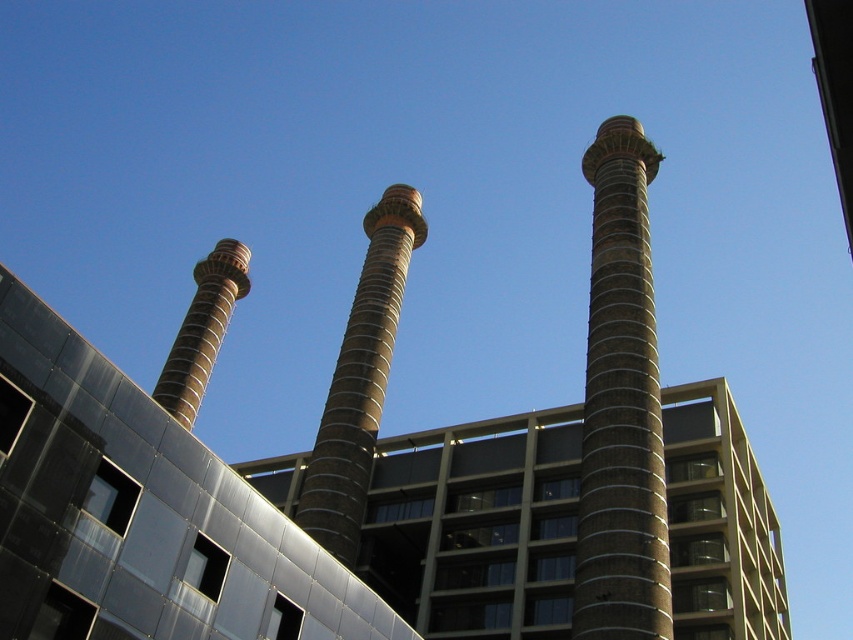
You are an architect reviewing the blueprint of the scene. You notice two structures, the brown textured tower at center and the brown textured chimney at left. Based on their positions in the image, which one appears closer to the ground?

The brown textured tower at center appears closer to the ground since it is positioned below the brown textured chimney at left.

You are standing at the base of the brown concrete pillar at right and want to walk to the nearest chimney. The nearest chimney is 20 meters away from the pillar. How far will you have to walk?

You will have to walk 20 meters to reach the nearest chimney from the brown concrete pillar at right.

From the picture: You are standing at the center of the image. Which direction should you move to reach the brown textured tower at center?

Since the brown textured tower at center is already at the center of the image, you don not need to move in any direction to reach it.